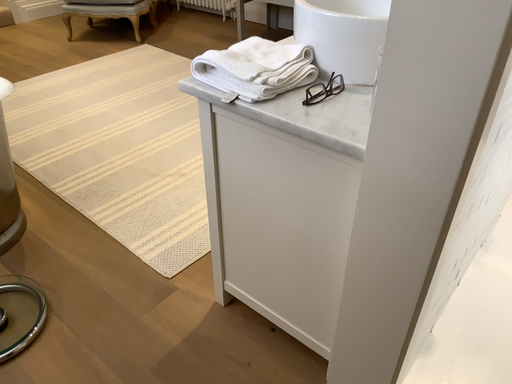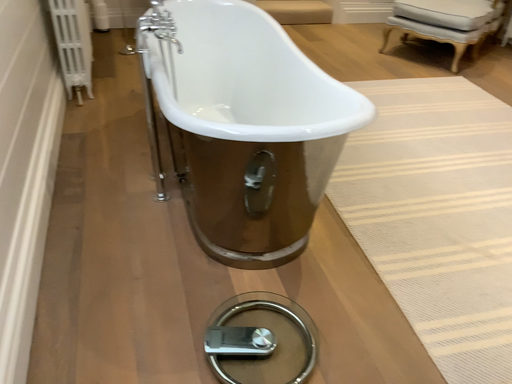
Question: How did the camera likely rotate when shooting the video?

Choices:
 (A) rotated right
 (B) rotated left

Answer: (B)